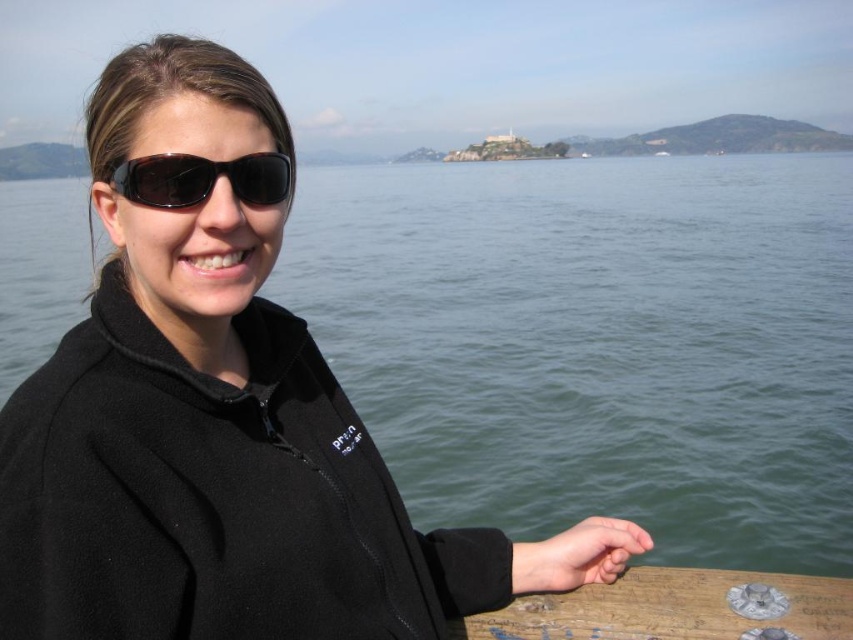
You are a photographer trying to capture the distant island in the background. You notice the green water at center and the matte black hand at lower right in your frame. Which object should you adjust to ensure the island is fully visible?

You should adjust the matte black hand at lower right because it is positioned behind the green water at center, blocking the view of the island in the background.

You are a photographer planning to capture the reflection of the distant island in the green water at center. Based on the coordinates provided, where should you position your camera to ensure the reflection is fully visible?

The green water at center is located at coordinates point (596, 342), so positioning the camera at that point would allow the reflection of the distant island to be fully visible.

You are a photographer trying to capture a photo of the person in the scene. You notice the black plastic sunglasses at upper center and the matte black hand at lower right in the frame. Which object should you adjust your focus on if you want to ensure the closer object is sharp?

The matte black hand at lower right is closer to the camera than the black plastic sunglasses at upper center, so you should focus on the matte black hand at lower right to ensure the closer object is sharp.